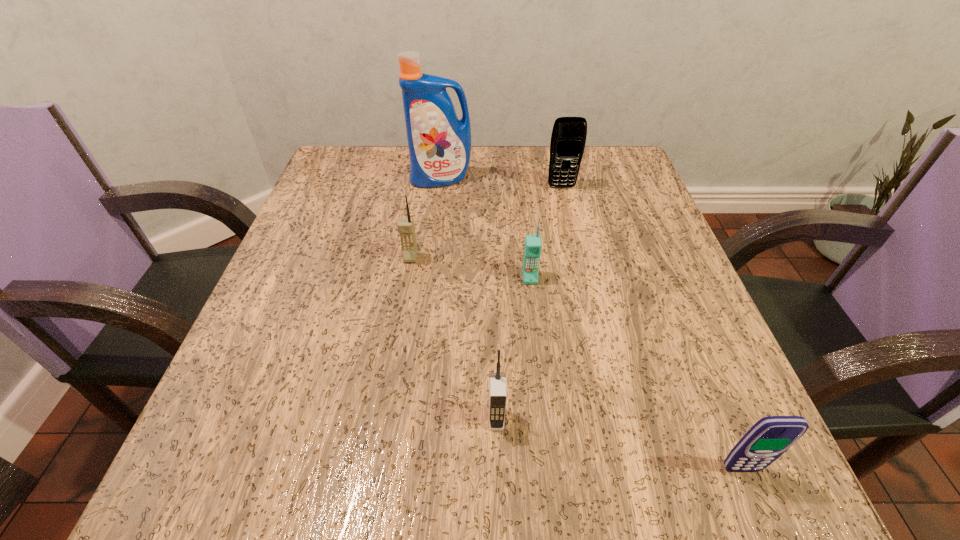
This screenshot has height=540, width=960. I want to click on the tallest object, so click(439, 143).

Where is `the fourth cellular telephone from left to right`? The width and height of the screenshot is (960, 540). the fourth cellular telephone from left to right is located at coordinates (568, 139).

This screenshot has height=540, width=960. Identify the location of the farthest cellular telephone. (568, 139).

I want to click on the leftmost cellular telephone, so click(x=406, y=228).

At what (x,y) coordinates should I click in order to perform the action: click on the fourth nearest cellular telephone. Please return your answer as a coordinate pair (x, y). The width and height of the screenshot is (960, 540). Looking at the image, I should click on (406, 228).

Image resolution: width=960 pixels, height=540 pixels. Find the location of `the second cellular telephone from left to right`. the second cellular telephone from left to right is located at coordinates (497, 381).

Where is `the second nearest cellular telephone`? the second nearest cellular telephone is located at coordinates (497, 381).

Where is `the fourth object from left to right`? The height and width of the screenshot is (540, 960). the fourth object from left to right is located at coordinates (532, 249).

This screenshot has height=540, width=960. Find the location of `the third nearest object`. the third nearest object is located at coordinates (532, 249).

What are the coordinates of `the rightmost cellular telephone` in the screenshot? It's located at 770,437.